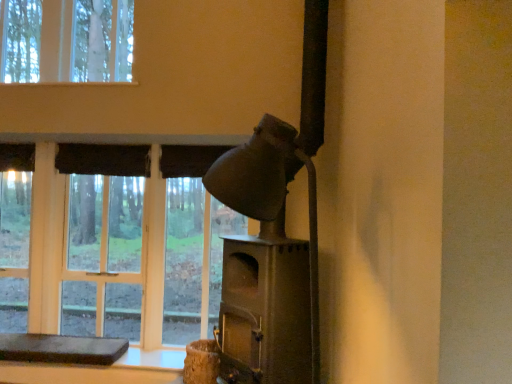
What do you see at coordinates (61, 349) in the screenshot? I see `brown leather cushion at lower left` at bounding box center [61, 349].

Identify the location of brown leather cushion at lower left. The width and height of the screenshot is (512, 384). (61, 349).

Considering the relative sizes of brown leather cushion at lower left and matte glass window at center in the image provided, is brown leather cushion at lower left thinner than matte glass window at center?

Incorrect, the width of brown leather cushion at lower left is not less than that of matte glass window at center.

From the image's perspective, is brown leather cushion at lower left below matte glass window at center?

Yes.

Is brown leather cushion at lower left completely or partially outside of matte glass window at center?

brown leather cushion at lower left is positioned outside matte glass window at center.

Considering the relative positions of matte gray fireplace at center-right and matte glass window at center in the image provided, is matte gray fireplace at center-right to the right of matte glass window at center from the viewer's perspective?

Yes.

From the picture: Does matte gray fireplace at center-right have a smaller size compared to matte glass window at center?

Incorrect, matte gray fireplace at center-right is not smaller in size than matte glass window at center.

Where is `fireplace above the matte glass window at center (from the image's perspective)`? fireplace above the matte glass window at center (from the image's perspective) is located at coordinates (266, 265).

From the image's perspective, between matte gray fireplace at center-right and matte glass window at center, which one is located above?

matte gray fireplace at center-right appears higher in the image.

Is brown leather cushion at lower left beside matte gray fireplace at center-right?

No, brown leather cushion at lower left is not with matte gray fireplace at center-right.

Is point (52, 358) positioned behind point (297, 355)?

Yes, point (52, 358) is farther from viewer.

Considering the sizes of objects brown leather cushion at lower left and matte gray fireplace at center-right in the image provided, who is bigger, brown leather cushion at lower left or matte gray fireplace at center-right?

With larger size is matte gray fireplace at center-right.

Does matte glass window at center have a lesser height compared to matte gray fireplace at center-right?

Indeed, matte glass window at center has a lesser height compared to matte gray fireplace at center-right.

Is matte glass window at center oriented towards matte gray fireplace at center-right?

Yes, matte glass window at center is aimed at matte gray fireplace at center-right.

The width and height of the screenshot is (512, 384). Find the location of `bay window lying behind the matte gray fireplace at center-right`. bay window lying behind the matte gray fireplace at center-right is located at coordinates coord(111,254).

Does matte glass window at center contain matte gray fireplace at center-right?

Actually, matte gray fireplace at center-right is outside matte glass window at center.

From a real-world perspective, is matte glass window at center physically above brown leather cushion at lower left?

Indeed, from a real-world perspective, matte glass window at center stands above brown leather cushion at lower left.

From the picture: Is matte glass window at center to the left or to the right of brown leather cushion at lower left in the image?

In the image, matte glass window at center appears on the right side of brown leather cushion at lower left.

Is brown leather cushion at lower left surrounded by matte gray fireplace at center-right?

No, brown leather cushion at lower left is not a part of matte gray fireplace at center-right.

Where is `fireplace above the brown leather cushion at lower left (from the image's perspective)`? Image resolution: width=512 pixels, height=384 pixels. fireplace above the brown leather cushion at lower left (from the image's perspective) is located at coordinates (266, 265).

Which object is closer to the camera, matte gray fireplace at center-right or brown leather cushion at lower left?

matte gray fireplace at center-right is more forward.

Is matte gray fireplace at center-right bigger than brown leather cushion at lower left?

Yes.

Identify the location of bay window positioned vertically above the brown leather cushion at lower left (from a real-world perspective). This screenshot has width=512, height=384. (111, 254).

Locate an element on the screen. Image resolution: width=512 pixels, height=384 pixels. bay window behind the matte gray fireplace at center-right is located at coordinates (111, 254).

Looking at the image, which one is located further to brown leather cushion at lower left, matte glass window at center or matte gray fireplace at center-right?

matte gray fireplace at center-right is positioned further to the anchor brown leather cushion at lower left.

From the image, which object appears to be nearer to brown leather cushion at lower left, matte gray fireplace at center-right or matte glass window at center?

Based on the image, matte glass window at center appears to be nearer to brown leather cushion at lower left.

Which object lies further to the anchor point matte gray fireplace at center-right, brown leather cushion at lower left or matte glass window at center?

Based on the image, brown leather cushion at lower left appears to be further to matte gray fireplace at center-right.

Based on their spatial positions, is brown leather cushion at lower left or matte gray fireplace at center-right further from matte glass window at center?

matte gray fireplace at center-right lies further to matte glass window at center than the other object.

Considering their positions, is matte gray fireplace at center-right positioned further to matte glass window at center than brown leather cushion at lower left?

Among the two, matte gray fireplace at center-right is located further to matte glass window at center.

Which object lies further to the anchor point matte gray fireplace at center-right, matte glass window at center or brown leather cushion at lower left?

Among the two, brown leather cushion at lower left is located further to matte gray fireplace at center-right.

Where is `bay window located between brown leather cushion at lower left and matte gray fireplace at center-right in the left-right direction`? The width and height of the screenshot is (512, 384). bay window located between brown leather cushion at lower left and matte gray fireplace at center-right in the left-right direction is located at coordinates (111, 254).